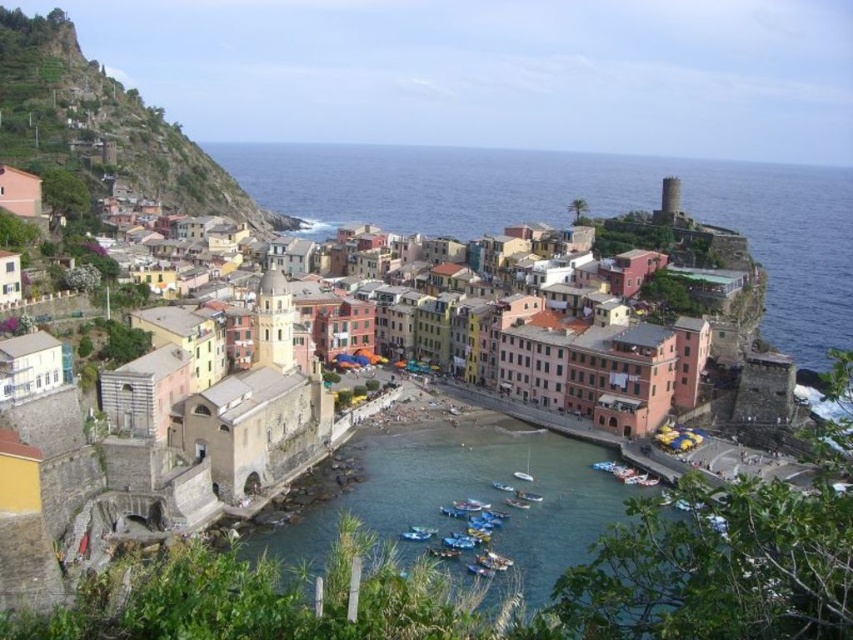
Question: Does rustic stone houses at upper left have a smaller size compared to metallic blue boat at lower center?

Choices:
 (A) no
 (B) yes

Answer: (A)

Question: Is rustic stone houses at upper left positioned in front of metallic blue boat at lower center?

Choices:
 (A) no
 (B) yes

Answer: (A)

Question: Among these objects, which one is farthest from the camera?

Choices:
 (A) metallic blue boat at lower center
 (B) rustic stone houses at upper left

Answer: (B)

Question: Can you confirm if rustic stone houses at upper left is wider than metallic blue boat at lower center?

Choices:
 (A) yes
 (B) no

Answer: (A)

Question: Among these points, which one is farthest from the camera?

Choices:
 (A) (135, 177)
 (B) (426, 529)

Answer: (A)